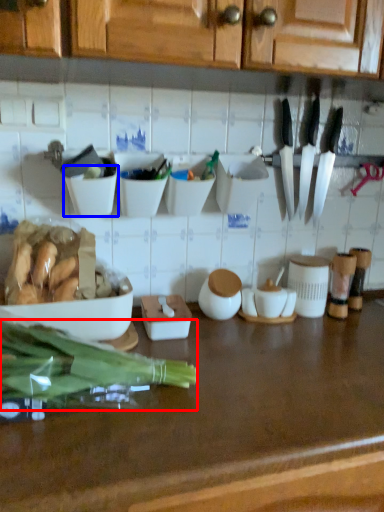
Question: Which object is further to the camera taking this photo, green vegetables (highlighted by a red box) or bowl (highlighted by a blue box)?

Choices:
 (A) green vegetables
 (B) bowl

Answer: (B)